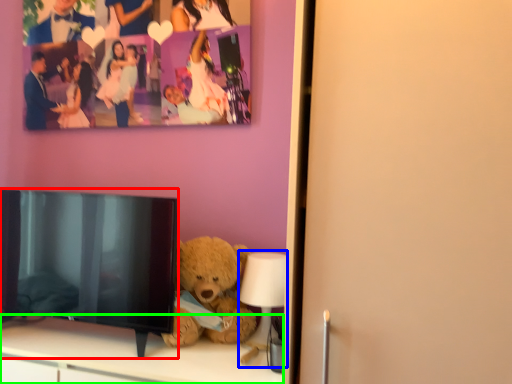
Question: Which is farther away from television (highlighted by a red box)? lamp (highlighted by a blue box) or furniture (highlighted by a green box)?

Choices:
 (A) lamp
 (B) furniture

Answer: (A)